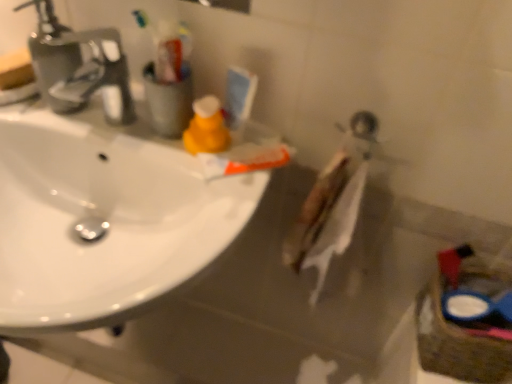
The width and height of the screenshot is (512, 384). In order to click on vacant area that is in front of white matte toothpaste at center in this screenshot , I will do `click(219, 215)`.